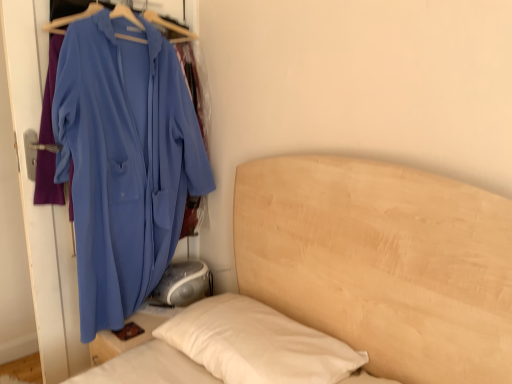
Question: Is wooden bed at center smaller than matte blue jacket at left?

Choices:
 (A) no
 (B) yes

Answer: (A)

Question: Is wooden bed at center positioned in front of matte blue jacket at left?

Choices:
 (A) yes
 (B) no

Answer: (A)

Question: Does wooden bed at center appear on the right side of matte blue jacket at left?

Choices:
 (A) no
 (B) yes

Answer: (B)

Question: Does wooden bed at center turn towards matte blue jacket at left?

Choices:
 (A) no
 (B) yes

Answer: (A)

Question: Is the position of wooden bed at center more distant than that of matte blue jacket at left?

Choices:
 (A) yes
 (B) no

Answer: (B)

Question: Are wooden bed at center and matte blue jacket at left far apart?

Choices:
 (A) yes
 (B) no

Answer: (B)

Question: From the image's perspective, does matte blue jacket at left appear higher than wooden bed at center?

Choices:
 (A) no
 (B) yes

Answer: (B)

Question: Is matte blue jacket at left next to wooden bed at center and touching it?

Choices:
 (A) yes
 (B) no

Answer: (B)

Question: Is matte blue jacket at left not inside wooden bed at center?

Choices:
 (A) no
 (B) yes

Answer: (B)

Question: From a real-world perspective, is matte blue jacket at left on top of wooden bed at center?

Choices:
 (A) yes
 (B) no

Answer: (A)

Question: Considering the relative sizes of matte blue jacket at left and wooden bed at center in the image provided, is matte blue jacket at left thinner than wooden bed at center?

Choices:
 (A) no
 (B) yes

Answer: (B)

Question: Are matte blue jacket at left and wooden bed at center located far from each other?

Choices:
 (A) yes
 (B) no

Answer: (B)

Question: Would you say matte blue jacket at left is to the left or to the right of wooden bed at center in the picture?

Choices:
 (A) right
 (B) left

Answer: (B)